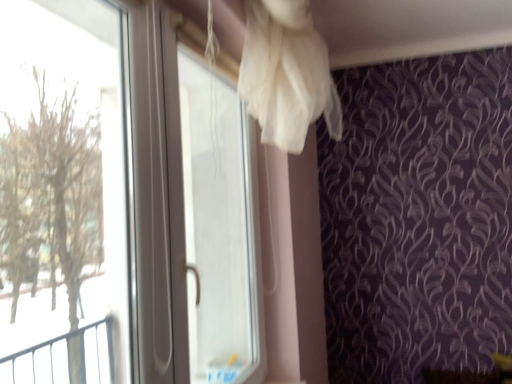
Question: Is transparent plastic screen door at upper center bigger or smaller than transparent plastic window at left?

Choices:
 (A) small
 (B) big

Answer: (B)

Question: From the image's perspective, is transparent plastic screen door at upper center above or below transparent plastic window at left?

Choices:
 (A) below
 (B) above

Answer: (A)

Question: In the image, is transparent plastic screen door at upper center positioned in front of or behind transparent plastic window at left?

Choices:
 (A) behind
 (B) front

Answer: (A)

Question: Is point (60, 225) positioned closer to the camera than point (234, 347)?

Choices:
 (A) farther
 (B) closer

Answer: (A)

Question: Is transparent plastic window at left wider or thinner than transparent plastic screen door at upper center?

Choices:
 (A) wide
 (B) thin

Answer: (B)

Question: Is transparent plastic window at left bigger or smaller than transparent plastic screen door at upper center?

Choices:
 (A) big
 (B) small

Answer: (B)

Question: Based on their positions, is transparent plastic window at left located to the left or right of transparent plastic screen door at upper center?

Choices:
 (A) right
 (B) left

Answer: (B)